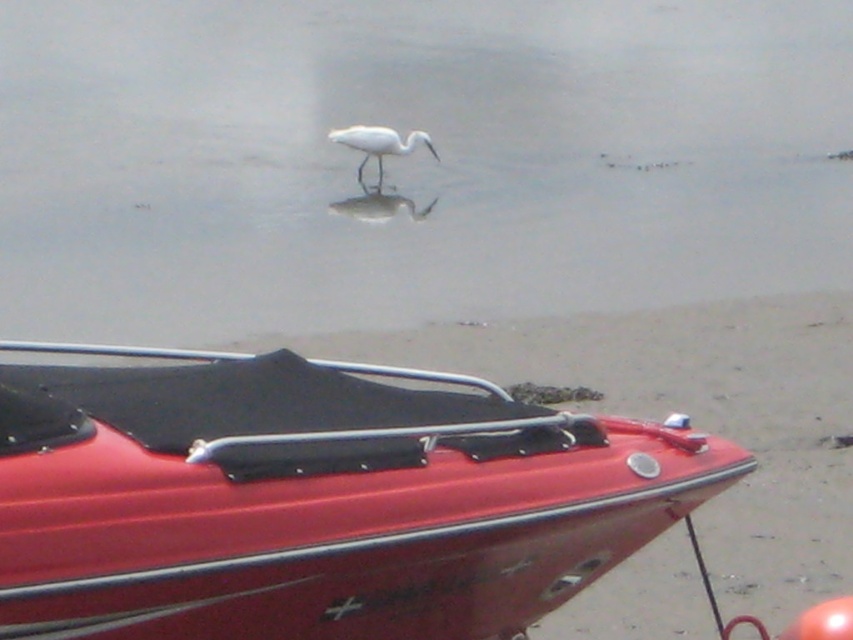
Question: Does white matte water at center lie behind shiny red boat at lower center?

Choices:
 (A) no
 (B) yes

Answer: (B)

Question: Can you confirm if white matte water at center is bigger than white matte bird at center?

Choices:
 (A) yes
 (B) no

Answer: (A)

Question: Is shiny red boat at lower center further to camera compared to white matte bird at center?

Choices:
 (A) yes
 (B) no

Answer: (B)

Question: Which object appears closest to the camera in this image?

Choices:
 (A) white matte bird at center
 (B) white matte water at center
 (C) shiny red boat at lower center

Answer: (C)

Question: Which point is farther to the camera?

Choices:
 (A) (221, 83)
 (B) (332, 134)
 (C) (169, 445)

Answer: (A)

Question: Estimate the real-world distances between objects in this image. Which object is farther from the white matte bird at center?

Choices:
 (A) shiny red boat at lower center
 (B) white matte water at center

Answer: (A)